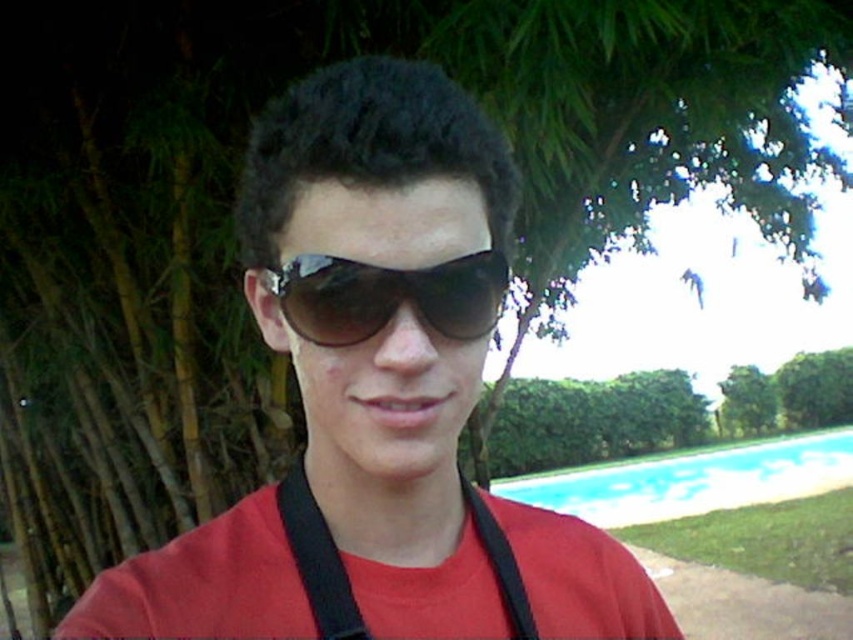
Question: Which object appears farthest from the camera in this image?

Choices:
 (A) black fabric strap at center
 (B) blue smooth water at lower right
 (C) matte black sunglasses at center
 (D) sunglasses at center

Answer: (B)

Question: Which object appears farthest from the camera in this image?

Choices:
 (A) sunglasses at center
 (B) blue smooth water at lower right
 (C) black fabric strap at center
 (D) matte black sunglasses at center

Answer: (B)

Question: Can you confirm if matte black sunglasses at center is positioned above sunglasses at center?

Choices:
 (A) yes
 (B) no

Answer: (B)

Question: Does blue smooth water at lower right appear on the right side of black fabric strap at center?

Choices:
 (A) yes
 (B) no

Answer: (A)

Question: Can you confirm if sunglasses at center is wider than black fabric strap at center?

Choices:
 (A) yes
 (B) no

Answer: (B)

Question: Which of the following is the farthest from the observer?

Choices:
 (A) matte black sunglasses at center
 (B) sunglasses at center
 (C) black fabric strap at center
 (D) blue smooth water at lower right

Answer: (D)